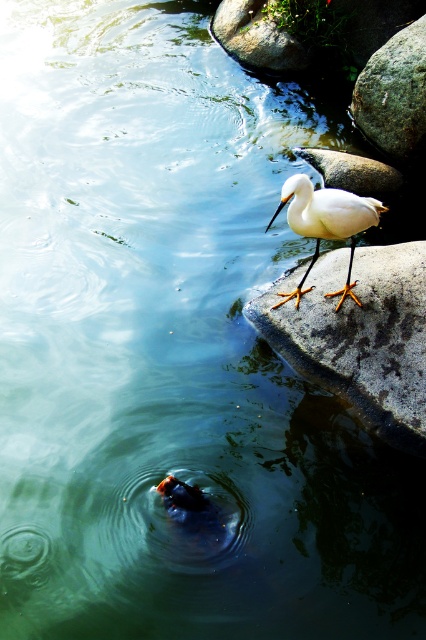
Is smooth gray rock at upper right closer to camera compared to white matte bird at upper right?

No, it is behind white matte bird at upper right.

Can you confirm if smooth gray rock at upper right is smaller than white matte bird at upper right?

Incorrect, smooth gray rock at upper right is not smaller in size than white matte bird at upper right.

Is point (362, 92) farther from camera compared to point (305, 232)?

Yes, it is.

What are the coordinates of `smooth gray rock at upper right` in the screenshot? It's located at (394, 93).

Does white matte stone at right appear under white matte bird at upper right?

Indeed, white matte stone at right is positioned under white matte bird at upper right.

Is white matte stone at right to the left of white matte bird at upper right from the viewer's perspective?

No, white matte stone at right is not to the left of white matte bird at upper right.

Between point (356, 412) and point (356, 196), which one is positioned in front?

Positioned in front is point (356, 196).

Locate an element on the screen. white matte stone at right is located at coordinates (359, 336).

Who is positioned more to the right, white matte stone at right or smooth gray rock at upper right?

From the viewer's perspective, smooth gray rock at upper right appears more on the right side.

Is white matte stone at right taller than smooth gray rock at upper right?

In fact, white matte stone at right may be shorter than smooth gray rock at upper right.

The image size is (426, 640). What are the coordinates of `white matte stone at right` in the screenshot? It's located at (359, 336).